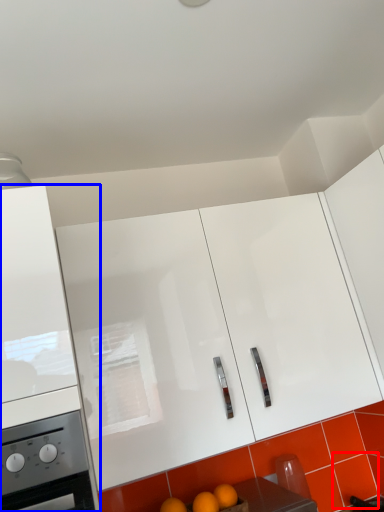
Question: Which of the following is the closest to the observer, tile (highlighted by a red box) or cabinetry (highlighted by a blue box)?

Choices:
 (A) tile
 (B) cabinetry

Answer: (B)